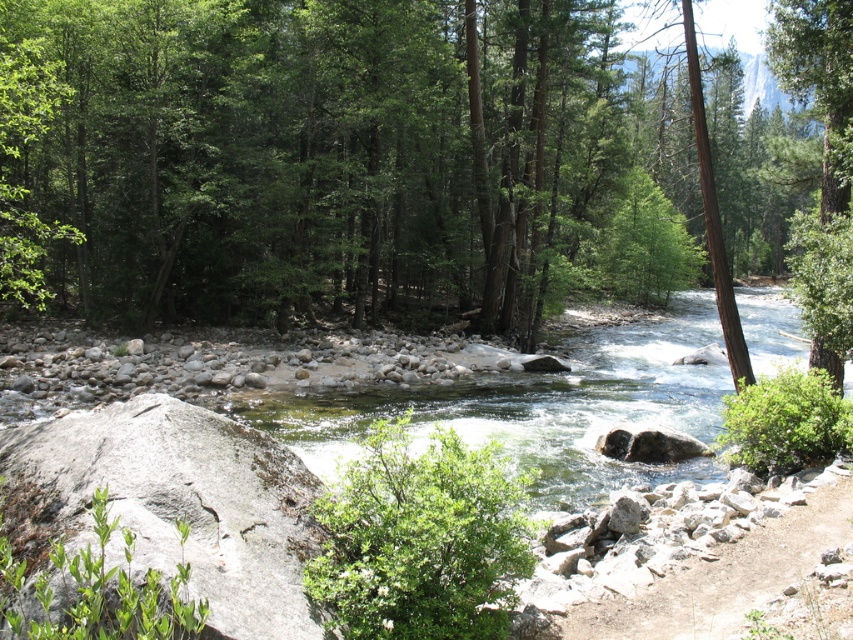
Question: Does green leafy tree at center appear on the left side of clear water at center?

Choices:
 (A) yes
 (B) no

Answer: (B)

Question: Considering the relative positions of green leafy tree at center and clear water at center in the image provided, where is green leafy tree at center located with respect to clear water at center?

Choices:
 (A) right
 (B) left

Answer: (A)

Question: Considering the real-world distances, which object is closest to the clear water at center?

Choices:
 (A) brown rough tree trunk at right
 (B) green leafy tree at center

Answer: (A)

Question: Is green leafy tree at center further to the viewer compared to clear water at center?

Choices:
 (A) yes
 (B) no

Answer: (B)

Question: Among these points, which one is farthest from the camera?

Choices:
 (A) (421, 237)
 (B) (544, 417)
 (C) (734, 330)

Answer: (A)

Question: Among these points, which one is nearest to the camera?

Choices:
 (A) (108, 170)
 (B) (693, 77)
 (C) (749, 308)

Answer: (B)